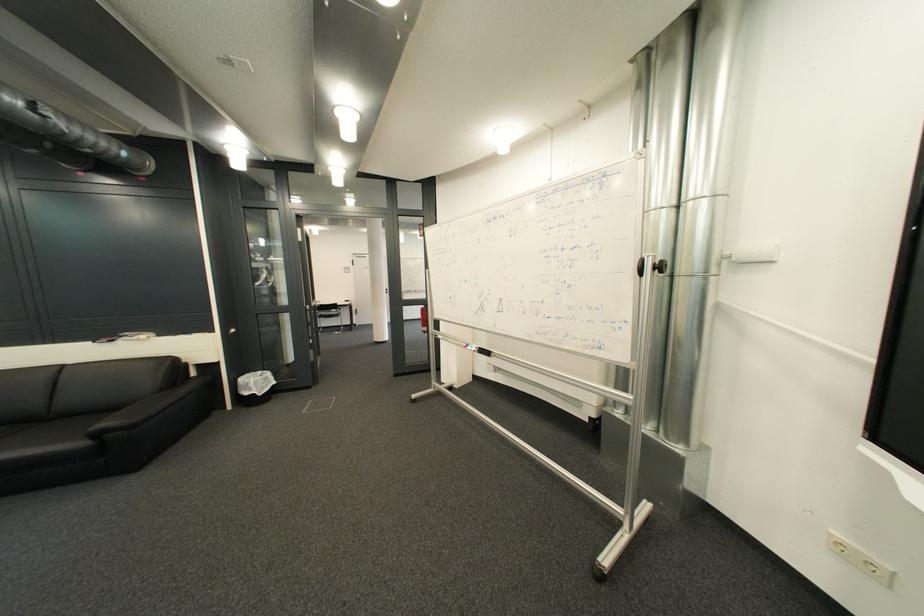
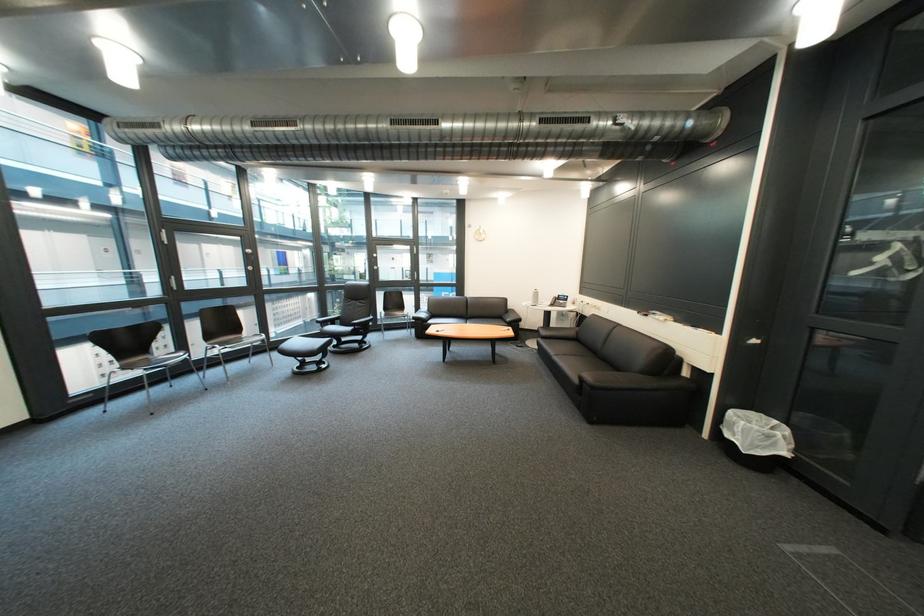
Where in the second image is the point corresponding to [207,376] from the first image?

(699, 375)